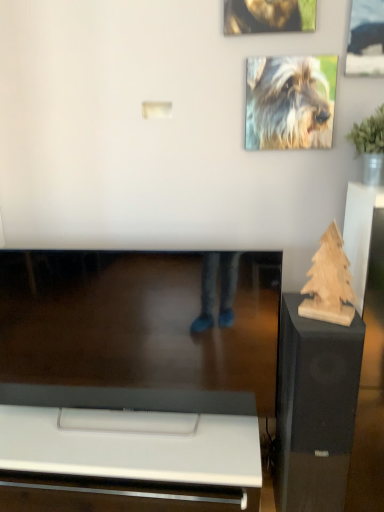
Question: Would you say fluffy fur dog at upper right, marked as the second dog in a top-to-bottom arrangement, is outside wooden sculpture at right?

Choices:
 (A) yes
 (B) no

Answer: (A)

Question: Is fluffy fur dog at upper right, marked as the second dog in a top-to-bottom arrangement, touching wooden sculpture at right?

Choices:
 (A) yes
 (B) no

Answer: (B)

Question: Can wooden sculpture at right be found inside fluffy fur dog at upper right, marked as the second dog in a top-to-bottom arrangement?

Choices:
 (A) yes
 (B) no

Answer: (B)

Question: Can you confirm if fluffy fur dog at upper right, which is counted as the first dog, starting from the bottom, is wider than wooden sculpture at right?

Choices:
 (A) no
 (B) yes

Answer: (A)

Question: From a real-world perspective, is fluffy fur dog at upper right, marked as the second dog in a top-to-bottom arrangement, beneath wooden sculpture at right?

Choices:
 (A) yes
 (B) no

Answer: (B)

Question: Considering the relative sizes of fluffy fur dog at upper right, which is counted as the first dog, starting from the bottom, and wooden sculpture at right in the image provided, is fluffy fur dog at upper right, which is counted as the first dog, starting from the bottom, thinner than wooden sculpture at right?

Choices:
 (A) no
 (B) yes

Answer: (B)

Question: Considering the relative sizes of metallic silver picture frame at upper right and fluffy fur dog at upper right, which is counted as the first dog, starting from the bottom, in the image provided, is metallic silver picture frame at upper right smaller than fluffy fur dog at upper right, which is counted as the first dog, starting from the bottom,?

Choices:
 (A) no
 (B) yes

Answer: (A)

Question: Is metallic silver picture frame at upper right bigger than fluffy fur dog at upper right, which is counted as the first dog, starting from the bottom?

Choices:
 (A) no
 (B) yes

Answer: (B)

Question: Is metallic silver picture frame at upper right aimed at fluffy fur dog at upper right, which is counted as the first dog, starting from the bottom?

Choices:
 (A) yes
 (B) no

Answer: (B)

Question: Is metallic silver picture frame at upper right touching fluffy fur dog at upper right, marked as the second dog in a top-to-bottom arrangement?

Choices:
 (A) no
 (B) yes

Answer: (A)

Question: Would you consider metallic silver picture frame at upper right to be distant from fluffy fur dog at upper right, marked as the second dog in a top-to-bottom arrangement?

Choices:
 (A) yes
 (B) no

Answer: (B)

Question: Can you confirm if metallic silver picture frame at upper right is wider than fluffy fur dog at upper right, which is counted as the first dog, starting from the bottom?

Choices:
 (A) yes
 (B) no

Answer: (A)

Question: Is shiny golden fur at upper center, which ranks as the second dog in bottom-to-top order, positioned before wooden sculpture at right?

Choices:
 (A) no
 (B) yes

Answer: (A)